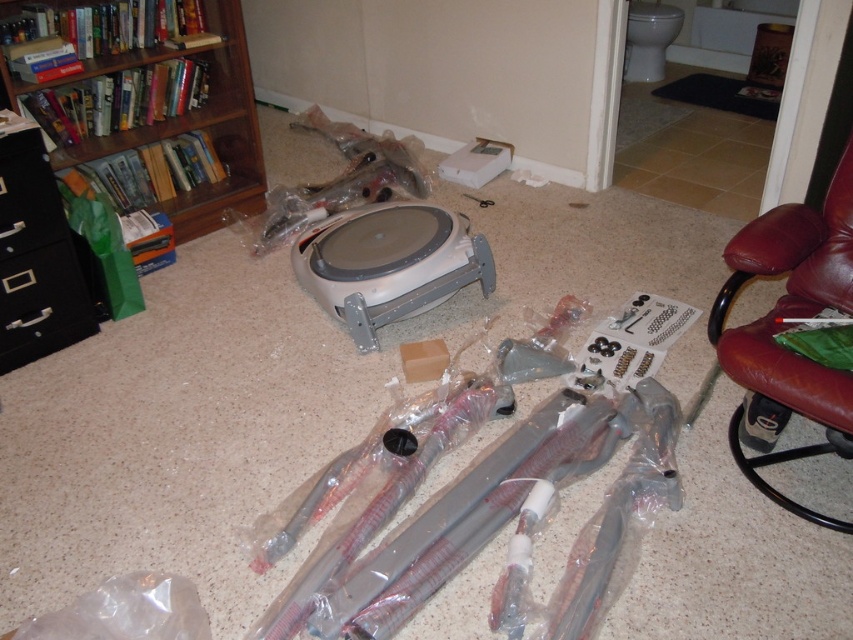
Does brown leather armchair at right have a greater height compared to wooden bookshelf at left?

Incorrect, brown leather armchair at right's height is not larger of wooden bookshelf at left's.

Can you confirm if brown leather armchair at right is smaller than wooden bookshelf at left?

Indeed, brown leather armchair at right has a smaller size compared to wooden bookshelf at left.

Where is `brown leather armchair at right`? brown leather armchair at right is located at coordinates (781, 328).

Where is `brown leather armchair at right`? brown leather armchair at right is located at coordinates (781, 328).

Is the position of white plastic robotic vacuum cleaner at center more distant than that of wooden bookshelf at left?

No, white plastic robotic vacuum cleaner at center is in front of wooden bookshelf at left.

Is point (480, 262) farther from camera compared to point (196, 230)?

No, it is not.

Locate an element on the screen. The height and width of the screenshot is (640, 853). white plastic robotic vacuum cleaner at center is located at coordinates click(387, 264).

Between brown leather armchair at right and black plastic drawer at left, which one has less height?

Standing shorter between the two is black plastic drawer at left.

Does brown leather armchair at right have a greater width compared to black plastic drawer at left?

Correct, the width of brown leather armchair at right exceeds that of black plastic drawer at left.

The image size is (853, 640). Describe the element at coordinates (781, 328) in the screenshot. I see `brown leather armchair at right` at that location.

You are a GUI agent. You are given a task and a screenshot of the screen. Output one action in this format:
    pyautogui.click(x=<x>, y=<y>)
    Task: Click on the brown leather armchair at right
    The height and width of the screenshot is (640, 853).
    Given the screenshot: What is the action you would take?
    pyautogui.click(x=781, y=328)